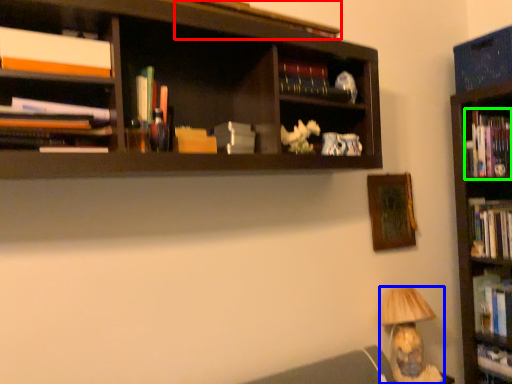
Question: Considering the real-world distances, which object is closest to book (highlighted by a red box)? lamp (highlighted by a blue box) or book (highlighted by a green box).

Choices:
 (A) lamp
 (B) book

Answer: (B)